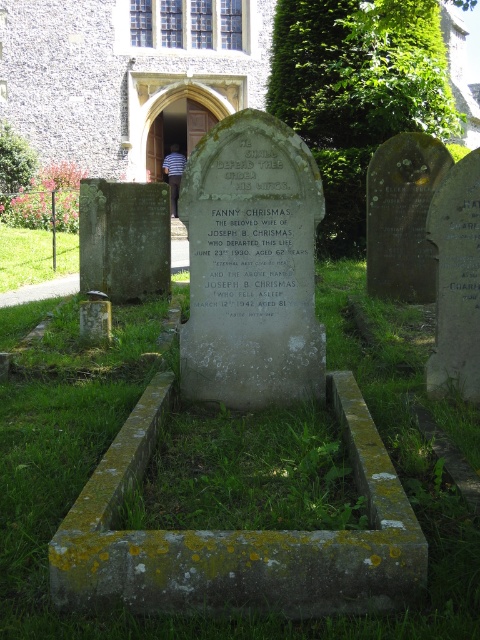
Is green mossy grass at center bigger than green grass at lower left?

Actually, green mossy grass at center might be smaller than green grass at lower left.

Where is `green mossy grass at center`? This screenshot has height=640, width=480. green mossy grass at center is located at coordinates (242, 616).